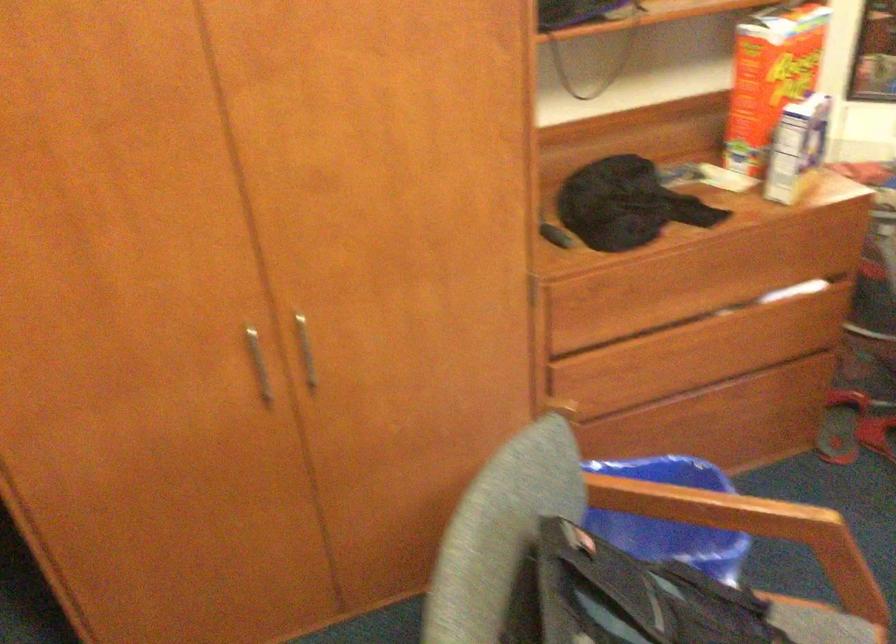
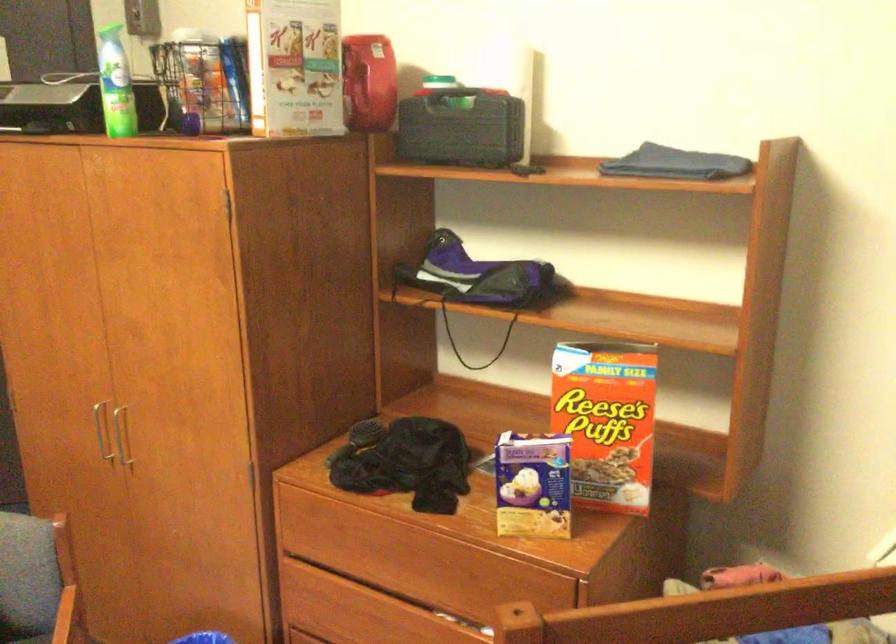
Locate, in the second image, the point that corresponds to [256,353] in the first image.

(100, 431)